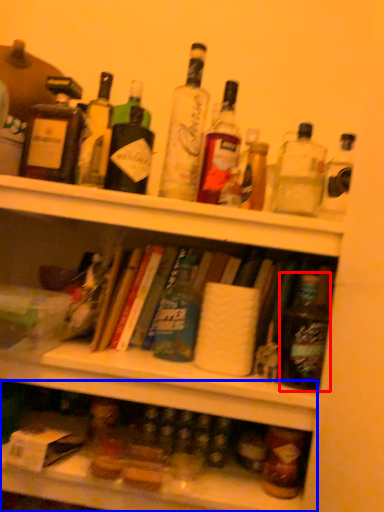
Question: Which of the following is the farthest to the observer, bottle (highlighted by a red box) or shelf (highlighted by a blue box)?

Choices:
 (A) bottle
 (B) shelf

Answer: (A)